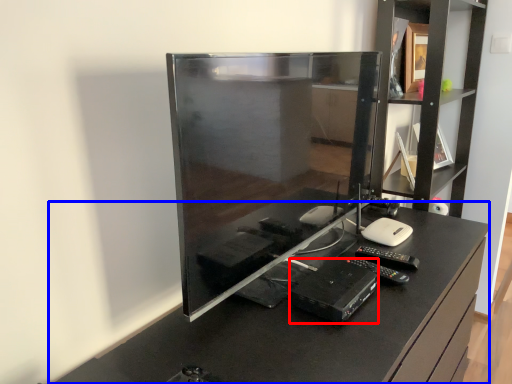
Question: Which object is further to the camera taking this photo, equipment (highlighted by a red box) or furniture (highlighted by a blue box)?

Choices:
 (A) equipment
 (B) furniture

Answer: (A)